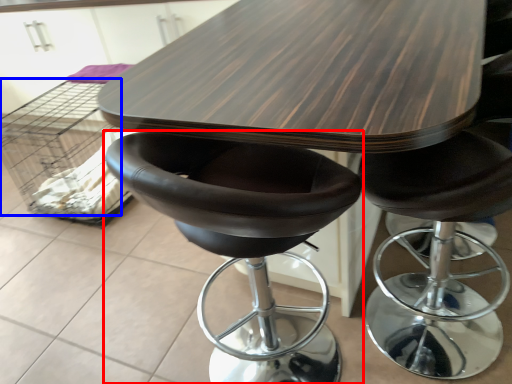
Question: Which point is further to the camera, chair (highlighted by a red box) or crate (highlighted by a blue box)?

Choices:
 (A) chair
 (B) crate

Answer: (B)